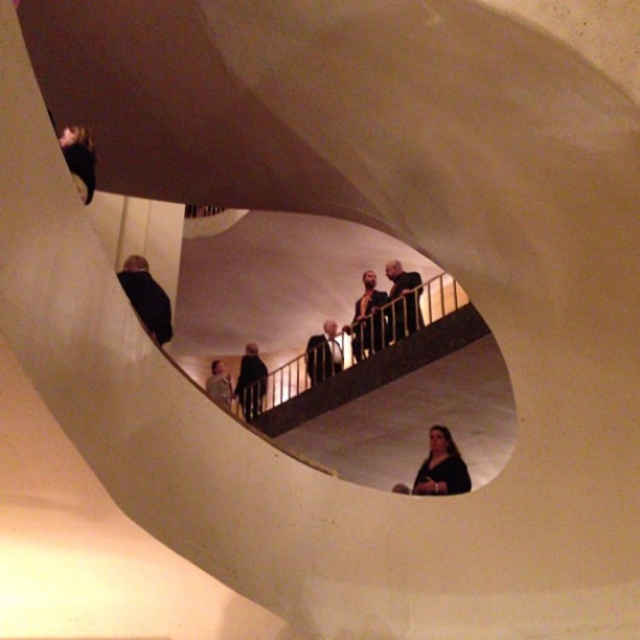
Locate an element on the screen. The height and width of the screenshot is (640, 640). dark gray jacket at center is located at coordinates (369, 317).

Which is behind, point (358, 353) or point (205, 381)?

The point (205, 381) is more distant.

Does point (362, 280) lie in front of point (228, 376)?

No, (362, 280) is behind (228, 376).

Locate an element on the screen. This screenshot has width=640, height=640. dark gray jacket at center is located at coordinates (369, 317).

Who is higher up, dark gray jacket at center or dark brown leather jacket at center?

dark brown leather jacket at center is above.

Is dark gray jacket at center above dark brown leather jacket at center?

Actually, dark gray jacket at center is below dark brown leather jacket at center.

Measure the distance between dark gray jacket at center and camera.

They are 27.50 feet apart.

The width and height of the screenshot is (640, 640). Identify the location of dark gray jacket at center. pos(369,317).

Is black matte jacket at lower left wider than dark gray jacket at center?

No.

Does black matte jacket at lower left appear under dark gray jacket at center?

No.

Between point (124, 268) and point (371, 289), which one is positioned in front?

Point (124, 268) is in front.

Locate an element on the screen. Image resolution: width=640 pixels, height=640 pixels. black matte jacket at lower left is located at coordinates (147, 298).